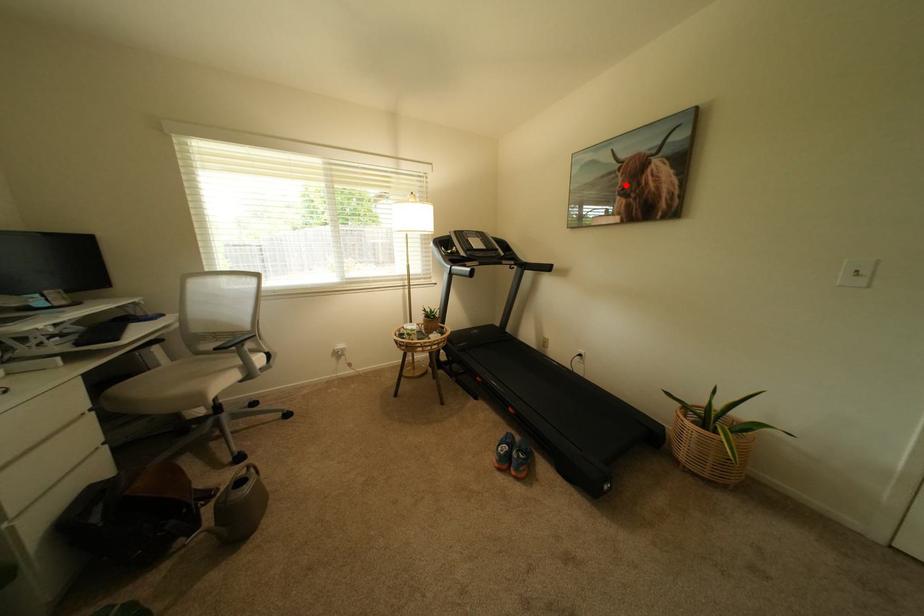
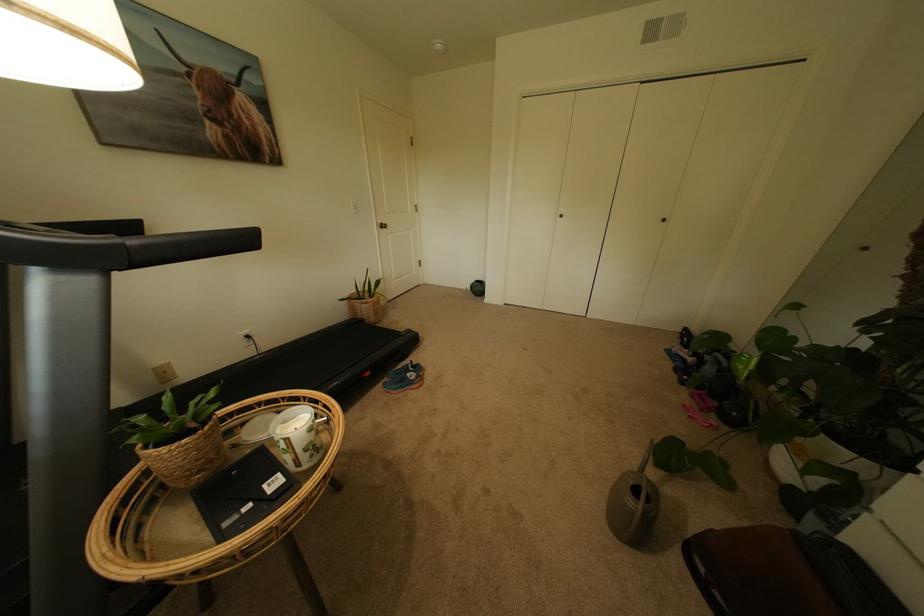
Question: I am providing you with two images of the same scene from different viewpoints. Image1 has a red point marked. In image2, the corresponding 3D location appears at what relative position? Reply with the corresponding letter.

Choices:
 (A) Closer
 (B) Farther

Answer: (A)